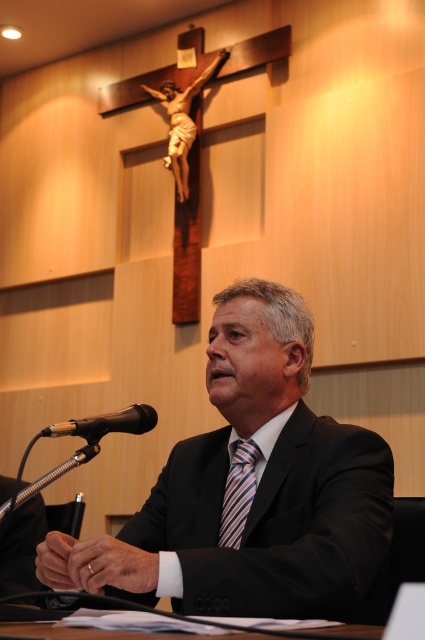
Question: Does striped silk tie at center appear on the left side of black matte microphone at lower left?

Choices:
 (A) yes
 (B) no

Answer: (B)

Question: Which point is farther to the camera?

Choices:
 (A) black matte microphone at lower left
 (B) striped silk tie at center
 (C) black suit at center

Answer: (B)

Question: Among these objects, which one is farthest from the camera?

Choices:
 (A) striped silk tie at center
 (B) black suit at center

Answer: (A)

Question: Does striped silk tie at center appear under black matte microphone at lower left?

Choices:
 (A) no
 (B) yes

Answer: (B)

Question: Which of the following is the farthest from the observer?

Choices:
 (A) (223, 499)
 (B) (373, 442)
 (C) (136, 404)

Answer: (C)

Question: Is black suit at center thinner than striped silk tie at center?

Choices:
 (A) no
 (B) yes

Answer: (A)